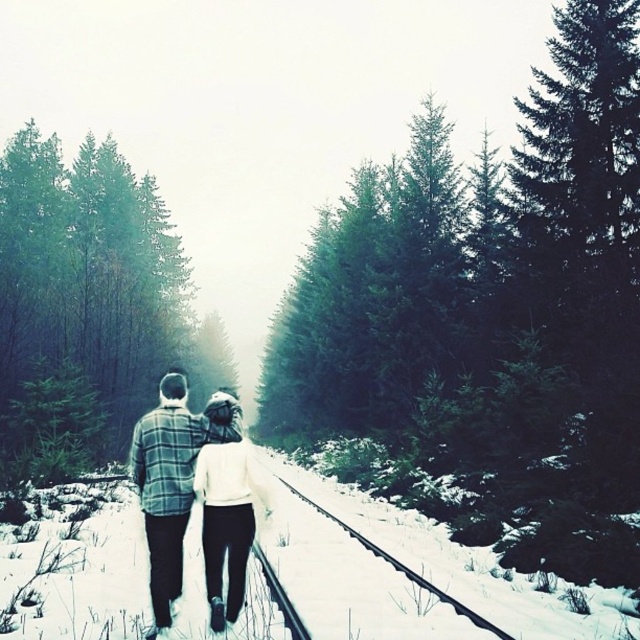
Question: Among these objects, which one is farthest from the camera?

Choices:
 (A) plaid flannel shirt at center
 (B) green matte tree at center

Answer: (B)

Question: Does green matte tree at center appear under plaid flannel shirt at center?

Choices:
 (A) yes
 (B) no

Answer: (B)

Question: Is green matte tree at center to the right of plaid flannel shirt at center from the viewer's perspective?

Choices:
 (A) no
 (B) yes

Answer: (B)

Question: Can you confirm if green matte tree at center is smaller than plaid flannel shirt at center?

Choices:
 (A) yes
 (B) no

Answer: (B)